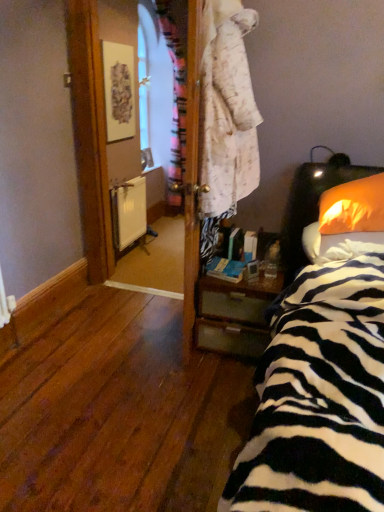
Question: From the image's perspective, is orange fabric pillow at right, which is the second pillow in top-to-bottom order, located beneath wooden nightstand at lower right?

Choices:
 (A) no
 (B) yes

Answer: (A)

Question: From a real-world perspective, does orange fabric pillow at right, placed as the first pillow when sorted from bottom to top, sit lower than wooden nightstand at lower right?

Choices:
 (A) yes
 (B) no

Answer: (B)

Question: Is orange fabric pillow at right, which is the second pillow in top-to-bottom order, further to the viewer compared to wooden nightstand at lower right?

Choices:
 (A) yes
 (B) no

Answer: (B)

Question: Can you confirm if orange fabric pillow at right, placed as the first pillow when sorted from bottom to top, is positioned to the left of wooden nightstand at lower right?

Choices:
 (A) no
 (B) yes

Answer: (A)

Question: Does orange fabric pillow at right, placed as the first pillow when sorted from bottom to top, have a larger size compared to wooden nightstand at lower right?

Choices:
 (A) no
 (B) yes

Answer: (A)

Question: Is orange fabric pillow at right, placed as the first pillow when sorted from bottom to top, situated inside orange fabric pillow at right, the 1th pillow in the top-to-bottom sequence, or outside?

Choices:
 (A) outside
 (B) inside

Answer: (A)

Question: Considering the positions of orange fabric pillow at right, which is the second pillow in top-to-bottom order, and orange fabric pillow at right, the 1th pillow in the top-to-bottom sequence, in the image, is orange fabric pillow at right, which is the second pillow in top-to-bottom order, wider or thinner than orange fabric pillow at right, the 1th pillow in the top-to-bottom sequence,?

Choices:
 (A) thin
 (B) wide

Answer: (B)

Question: From a real-world perspective, is orange fabric pillow at right, which is the second pillow in top-to-bottom order, physically located above or below orange fabric pillow at right, the 1th pillow in the top-to-bottom sequence?

Choices:
 (A) above
 (B) below

Answer: (B)

Question: From the image's perspective, is orange fabric pillow at right, placed as the first pillow when sorted from bottom to top, above or below orange fabric pillow at right, the 1th pillow in the top-to-bottom sequence?

Choices:
 (A) above
 (B) below

Answer: (B)

Question: Is zebra-patterned fabric at right to the left or to the right of wooden nightstand at lower right in the image?

Choices:
 (A) left
 (B) right

Answer: (B)

Question: From a real-world perspective, is zebra-patterned fabric at right above or below wooden nightstand at lower right?

Choices:
 (A) above
 (B) below

Answer: (A)

Question: Do you think zebra-patterned fabric at right is within wooden nightstand at lower right, or outside of it?

Choices:
 (A) inside
 (B) outside

Answer: (B)

Question: In terms of size, does zebra-patterned fabric at right appear bigger or smaller than wooden nightstand at lower right?

Choices:
 (A) small
 (B) big

Answer: (B)

Question: Visually, is white matte radiator at center positioned to the left or to the right of orange fabric pillow at right, the second pillow in the bottom-to-top sequence?

Choices:
 (A) left
 (B) right

Answer: (A)

Question: Is white matte radiator at center taller or shorter than orange fabric pillow at right, the 1th pillow in the top-to-bottom sequence?

Choices:
 (A) short
 (B) tall

Answer: (B)